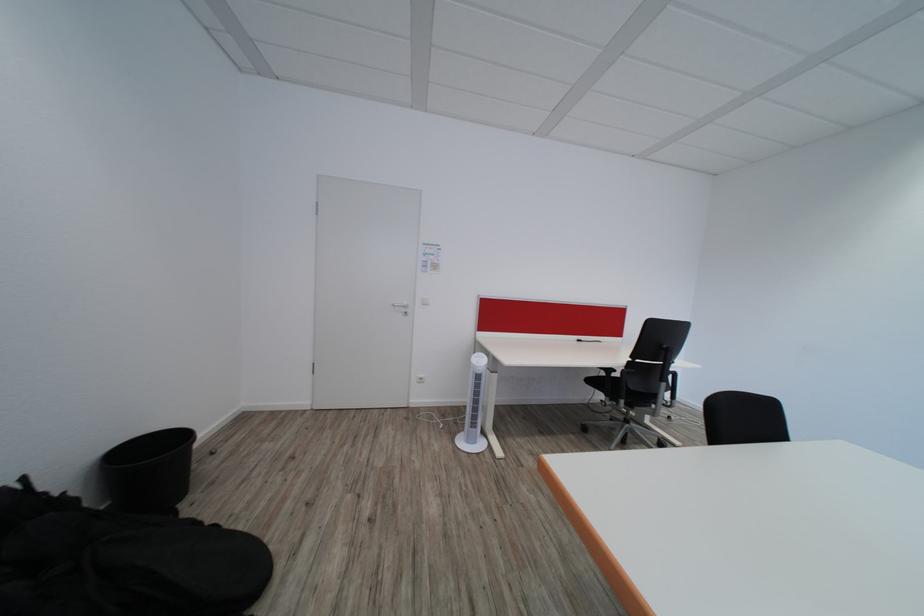
Find the location of a particular element. Image resolution: width=924 pixels, height=616 pixels. black wastebasket is located at coordinates (149, 471).